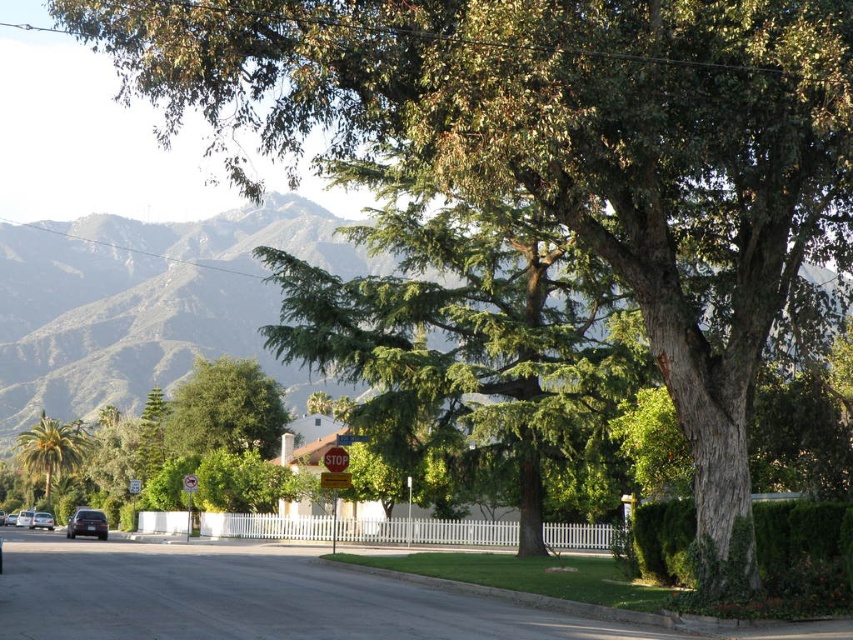
Looking at this image, you are a pedestrian standing on the sidewalk and looking at the green leafy mountain at upper center and the silver metallic sedan at center. Which object is higher in the image?

The green leafy mountain at upper center is higher than the silver metallic sedan at center in the image.

You are standing at the edge of the suburban street scene. There is a point marked at coordinates point (93, 346). Can you estimate how far this point is from you in meters?

The distance of point (93, 346) from viewer is 117.55 meters.

You are standing at the point with coordinates (335, 460). What object is located exactly at your current position?

The metallic stop sign at center is located exactly at point (335, 460).